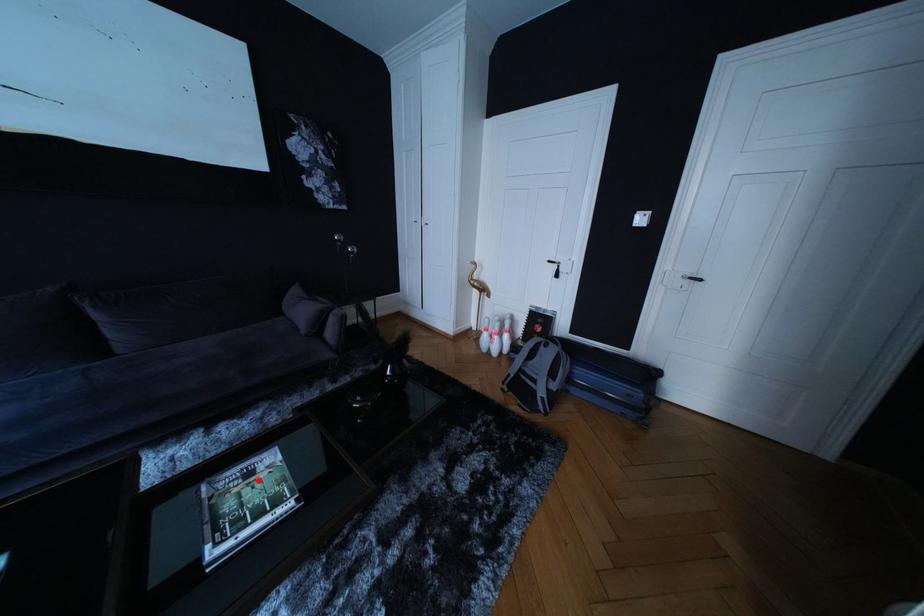
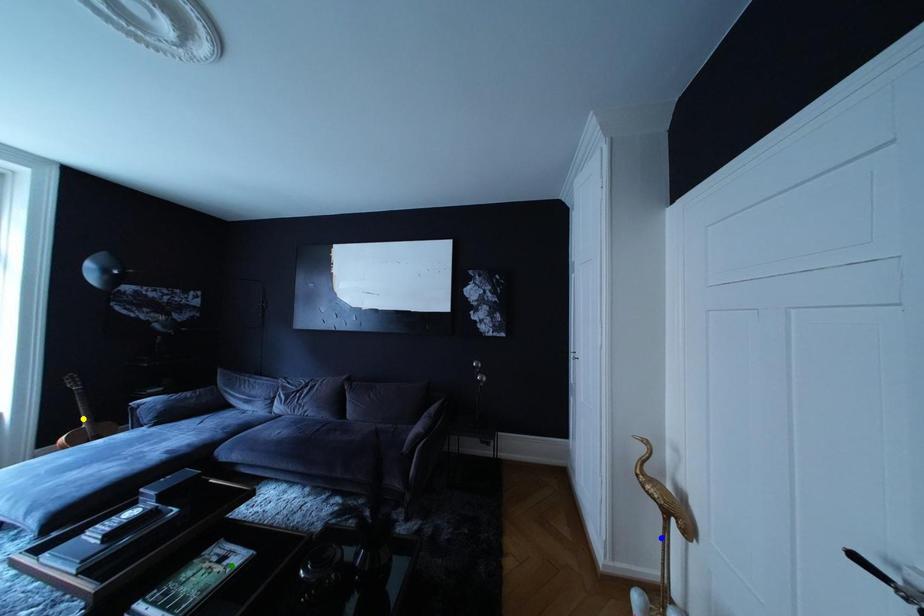
Question: I am providing you with two images of the same scene from different viewpoints. A red point is marked on the first image. You are given multiple points on the second image. In image 2, which mark is for the same physical point as the one in image 1?

Choices:
 (A) blue point
 (B) yellow point
 (C) green point

Answer: (C)